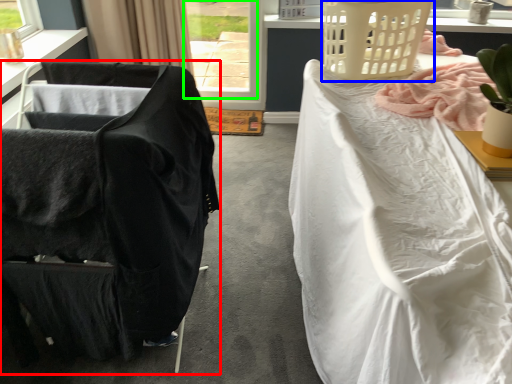
Question: Which object is the closest to the chair (highlighted by a red box)? Choose among these: basket (highlighted by a blue box) or window (highlighted by a green box).

Choices:
 (A) basket
 (B) window

Answer: (A)